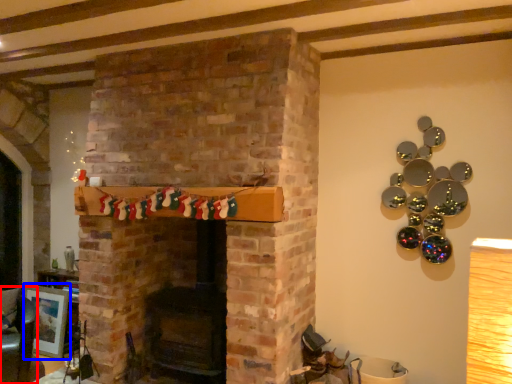
Question: Which of the following is the closest to the observer, armchair (highlighted by a red box) or picture frame (highlighted by a blue box)?

Choices:
 (A) armchair
 (B) picture frame

Answer: (A)